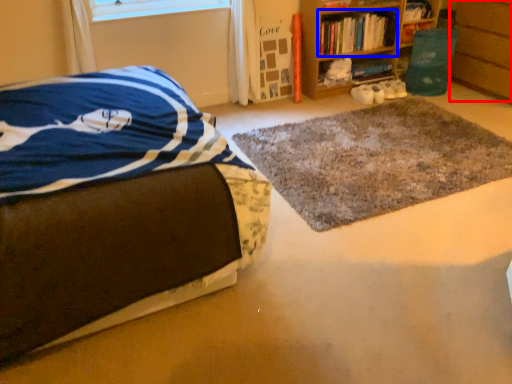
Question: Which point is closer to the camera, cabinetry (highlighted by a red box) or book (highlighted by a blue box)?

Choices:
 (A) cabinetry
 (B) book

Answer: (A)